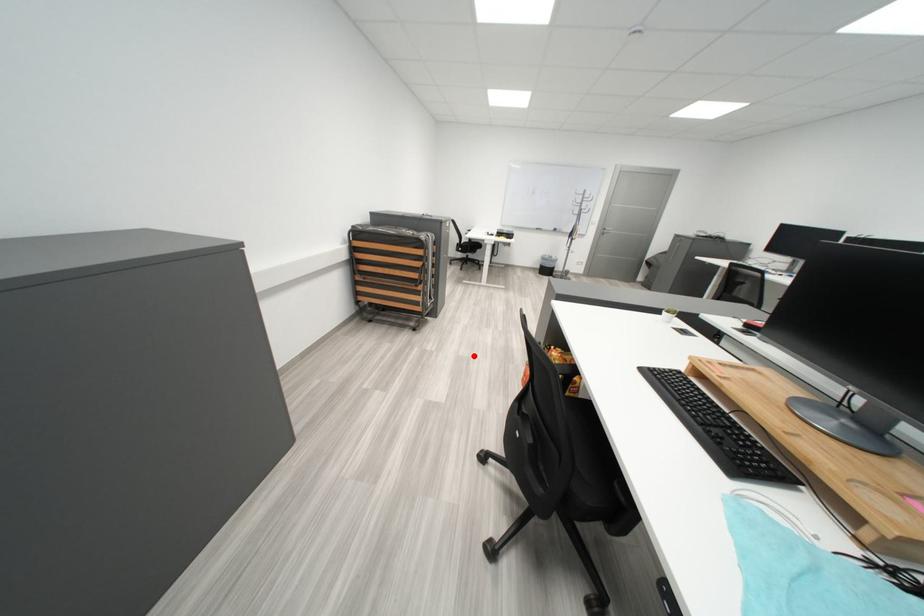
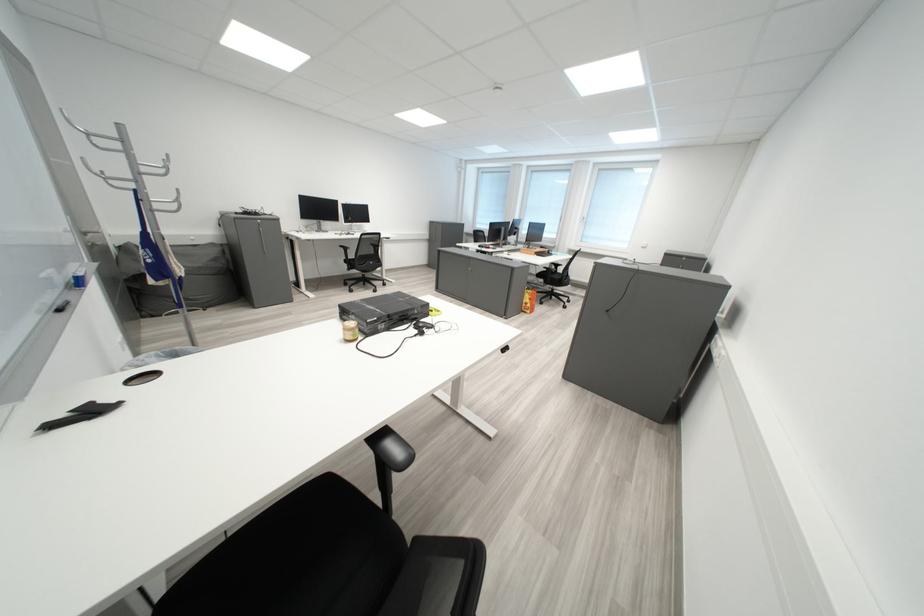
Question: I am providing you with two images of the same scene from different viewpoints. Image1 has a red point marked. In image2, the corresponding 3D location appears at what relative position? Reply with the corresponding letter.

Choices:
 (A) Closer
 (B) Farther

Answer: (A)